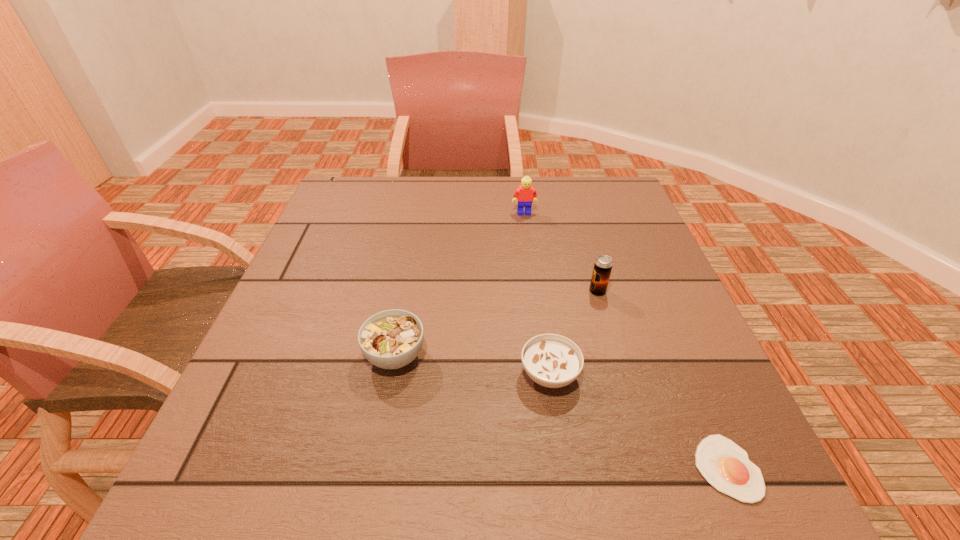
Identify the location of the farthest object. Image resolution: width=960 pixels, height=540 pixels. (524, 194).

Identify the location of Lego. (524, 194).

This screenshot has height=540, width=960. I want to click on beer can, so click(603, 264).

Where is `the second farthest object`? This screenshot has width=960, height=540. the second farthest object is located at coordinates (603, 264).

Locate an element on the screen. Image resolution: width=960 pixels, height=540 pixels. the third tallest object is located at coordinates (391, 339).

Where is `the leftmost object`? the leftmost object is located at coordinates (391, 339).

Where is `the right soup bowl`? the right soup bowl is located at coordinates (553, 361).

At what (x,y) coordinates should I click in order to perform the action: click on the fourth tallest object. Please return your answer as a coordinate pair (x, y). Looking at the image, I should click on pyautogui.click(x=553, y=361).

Locate an element on the screen. Image resolution: width=960 pixels, height=540 pixels. egg yolk is located at coordinates point(726,466).

Find the location of a particular element. the rightmost object is located at coordinates (726, 466).